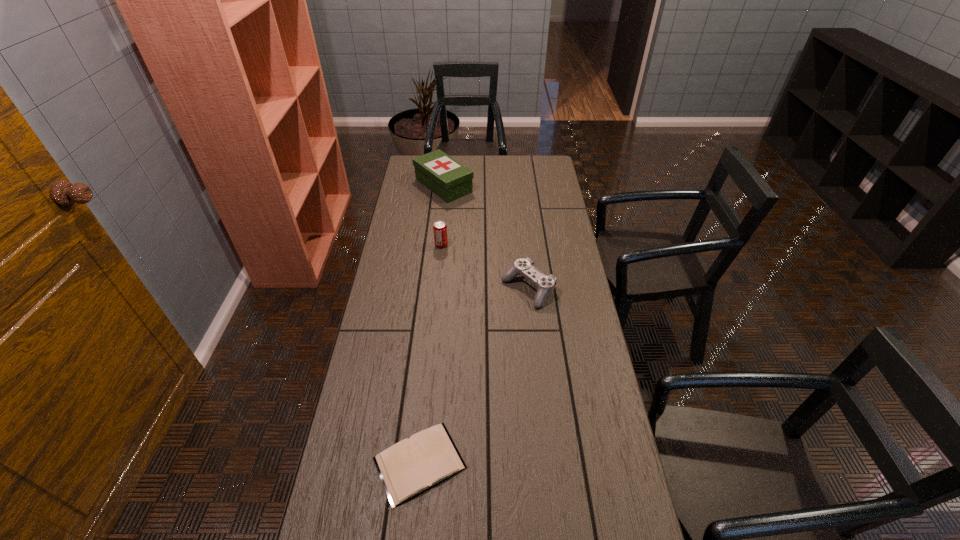
You are a GUI agent. You are given a task and a screenshot of the screen. Output one action in this format:
    pyautogui.click(x=<x>, y=<y>)
    Task: Click on the object at the far edge
    Image resolution: width=960 pixels, height=540 pixels.
    Given the screenshot: What is the action you would take?
    pyautogui.click(x=447, y=178)

In order to click on the first-aid kit that is at the left edge in this screenshot , I will do `click(447, 178)`.

Where is `hardback book present at the left edge`? The height and width of the screenshot is (540, 960). hardback book present at the left edge is located at coordinates (411, 466).

Find the location of a particular element. This screenshot has width=960, height=540. object that is at the right edge is located at coordinates (545, 284).

Where is `object located in the far left corner section of the desktop`? The image size is (960, 540). object located in the far left corner section of the desktop is located at coordinates (447, 178).

This screenshot has height=540, width=960. In the image, there is a desktop. In order to click on vacant region at the far edge in this screenshot , I will do `click(480, 160)`.

At what (x,y) coordinates should I click in order to perform the action: click on free space at the left edge of the desktop. Please return your answer as a coordinate pair (x, y). The width and height of the screenshot is (960, 540). Looking at the image, I should click on (345, 451).

Image resolution: width=960 pixels, height=540 pixels. I want to click on vacant space at the right edge, so click(588, 377).

I want to click on free space between the second farthest object and the hardback book, so click(430, 354).

Where is `free spot between the shortest object and the third nearest object`? This screenshot has width=960, height=540. free spot between the shortest object and the third nearest object is located at coordinates (430, 354).